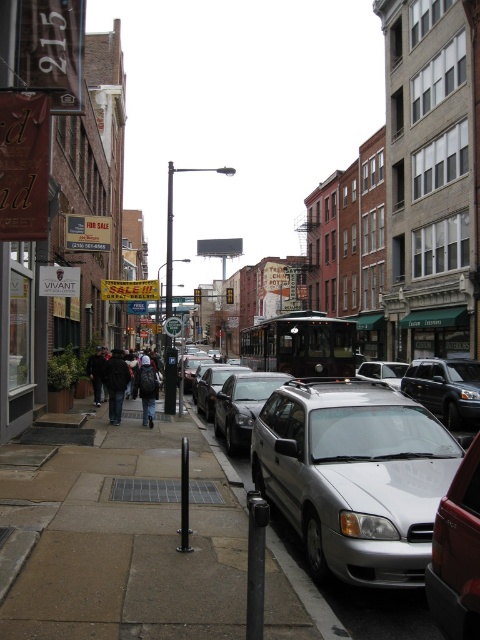
The width and height of the screenshot is (480, 640). In order to click on silver metallic sedan at center in this screenshot , I will do `click(242, 404)`.

Can you confirm if silver metallic sedan at center is bigger than satin silver sedan at center?

Incorrect, silver metallic sedan at center is not larger than satin silver sedan at center.

This screenshot has width=480, height=640. In order to click on silver metallic sedan at center in this screenshot , I will do `click(242, 404)`.

Locate an element on the screen. silver metallic sedan at center is located at coordinates [242, 404].

Does point (430, 392) lie behind point (244, 428)?

That is True.

Is point (478, 406) closer to viewer compared to point (231, 451)?

No, (478, 406) is behind (231, 451).

Where is `shiny black suv at center`? This screenshot has width=480, height=640. shiny black suv at center is located at coordinates (444, 388).

Which of these two, shiny black suv at center or dark brown leather jacket at lower left, stands shorter?

dark brown leather jacket at lower left

Who is lower down, shiny black suv at center or dark brown leather jacket at lower left?

shiny black suv at center is lower down.

Between point (440, 417) and point (95, 397), which one is positioned behind?

Positioned behind is point (95, 397).

Where is `shiny black suv at center`? This screenshot has height=640, width=480. shiny black suv at center is located at coordinates (444, 388).